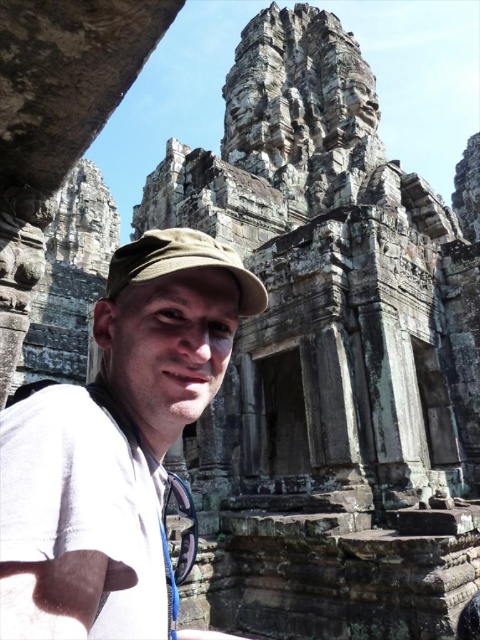
You are standing in front of the ancient temple structure at Bayon Temple. You notice two points marked on the stone faces of the temple. The first point is at coordinate [24,449] and the second is at [224,262]. Which of these points is nearer to your current position?

Point [24,449] is closer to the viewer than point [224,262].